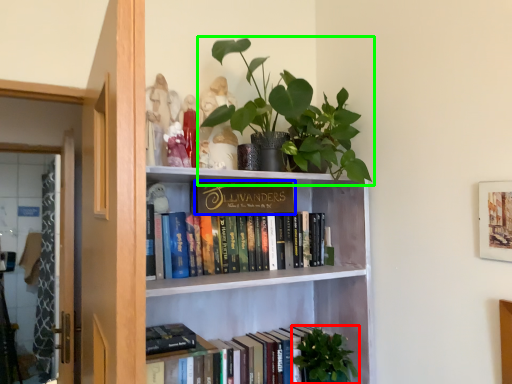
Question: Based on their relative distances, which object is farther from vegetation (highlighted by a red box)? Choose from paperback book (highlighted by a blue box) and houseplant (highlighted by a green box).

Choices:
 (A) paperback book
 (B) houseplant

Answer: (B)